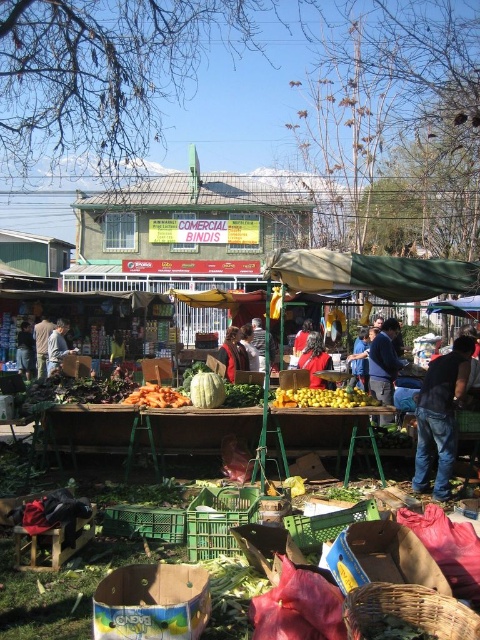
Who is shorter, jeans at lower right or dark blue jeans at center?

Standing shorter between the two is dark blue jeans at center.

Is jeans at lower right thinner than dark blue jeans at center?

No.

Identify the location of jeans at lower right. (441, 417).

Which is more to the right, blue jeans at center or dark gray sweater at center?

dark gray sweater at center is more to the right.

This screenshot has height=640, width=480. What do you see at coordinates (24, 349) in the screenshot? I see `blue jeans at center` at bounding box center [24, 349].

The width and height of the screenshot is (480, 640). Find the location of `blue jeans at center`. blue jeans at center is located at coordinates (24, 349).

Does jeans at lower right have a smaller size compared to brown leather jacket at center?

Yes.

Is point (428, 390) in front of point (52, 339)?

Yes, it is in front of point (52, 339).

Which is in front, point (459, 348) or point (60, 324)?

Point (459, 348) is in front.

The height and width of the screenshot is (640, 480). I want to click on jeans at lower right, so click(441, 417).